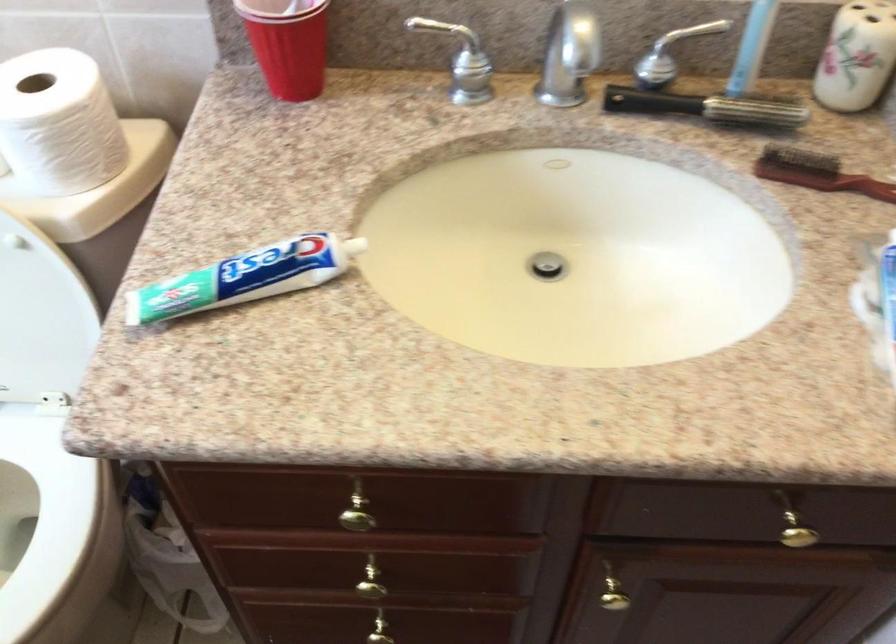
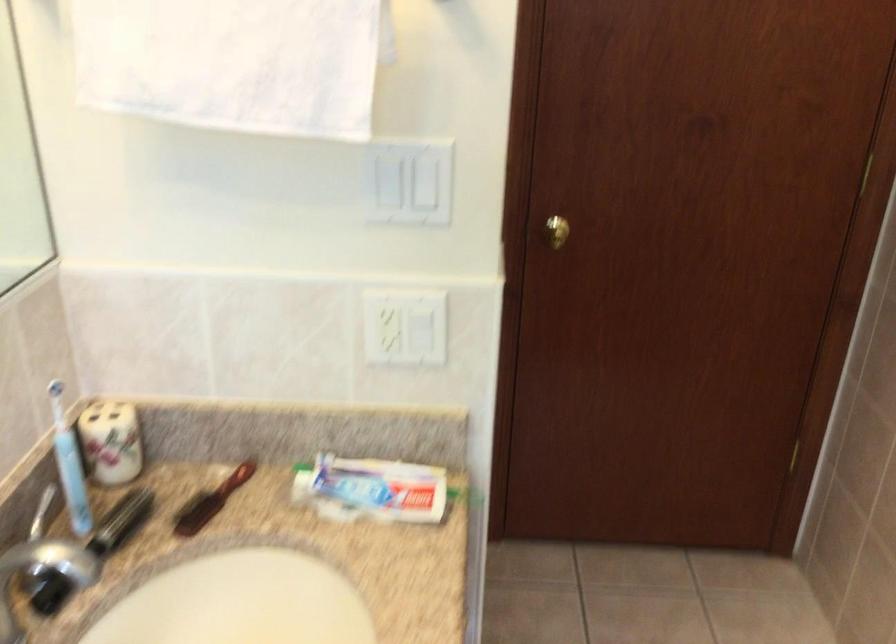
Consider the image. Based on the continuous images, in which direction is the camera rotating?

The camera rotated toward right-down.